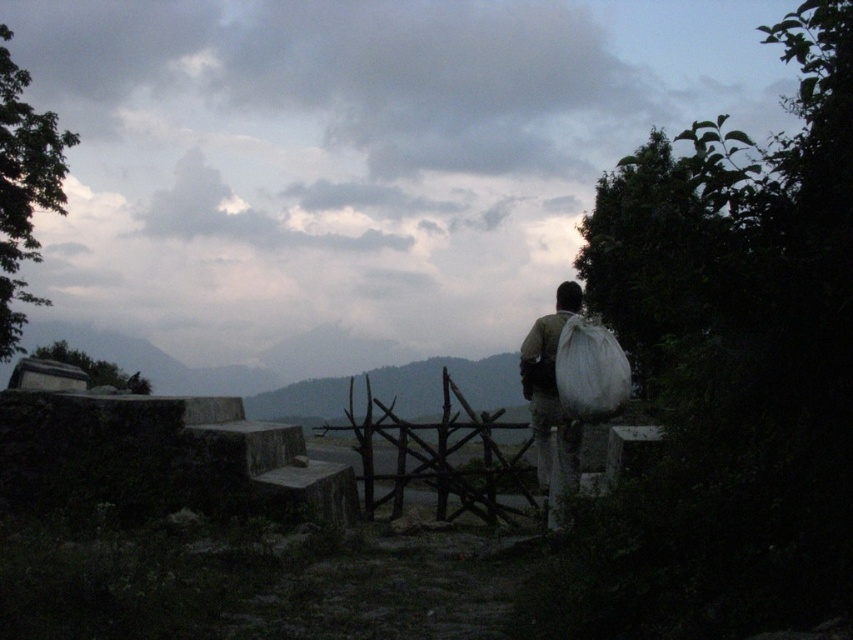
Question: Among these points, which one is farthest from the camera?

Choices:
 (A) tap(560, 372)
 (B) tap(538, 449)

Answer: (B)

Question: Where is white fabric bag at center located in relation to white fabric bag at right in the image?

Choices:
 (A) right
 (B) left

Answer: (B)

Question: In this image, where is white fabric bag at center located relative to white fabric bag at right?

Choices:
 (A) below
 (B) above

Answer: (A)

Question: Does white fabric bag at center appear on the left side of white fabric bag at right?

Choices:
 (A) no
 (B) yes

Answer: (B)

Question: Which point is closer to the camera?

Choices:
 (A) (560, 490)
 (B) (566, 352)

Answer: (B)